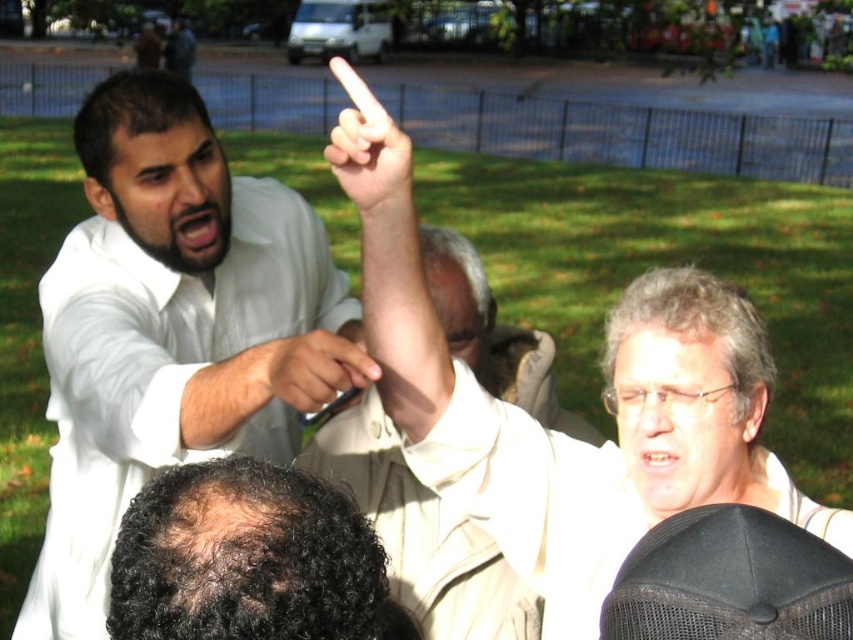
Question: Is white matte shirt at upper left further to camera compared to matte black pen at upper center?

Choices:
 (A) no
 (B) yes

Answer: (B)

Question: Considering the real-world distances, which object is closest to the matte black pen at upper center?

Choices:
 (A) white matte shirt at upper left
 (B) smooth skin finger at upper center

Answer: (B)

Question: Is smooth skin finger at upper center smaller than matte black pen at upper center?

Choices:
 (A) yes
 (B) no

Answer: (B)

Question: Which object is farther from the camera taking this photo?

Choices:
 (A) matte black pen at upper center
 (B) smooth skin finger at upper center

Answer: (A)

Question: Considering the relative positions of white matte shirt at upper left and matte black pen at upper center in the image provided, where is white matte shirt at upper left located with respect to matte black pen at upper center?

Choices:
 (A) right
 (B) left

Answer: (B)

Question: Which point is closer to the camera taking this photo?

Choices:
 (A) [347, 336]
 (B) [383, 205]
 (C) [91, 220]

Answer: (B)